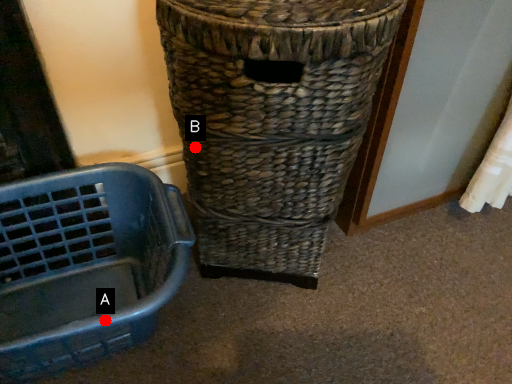
Question: Two points are circled on the image, labeled by A and B beside each circle. Which point is closer to the camera?

Choices:
 (A) A is closer
 (B) B is closer

Answer: (A)